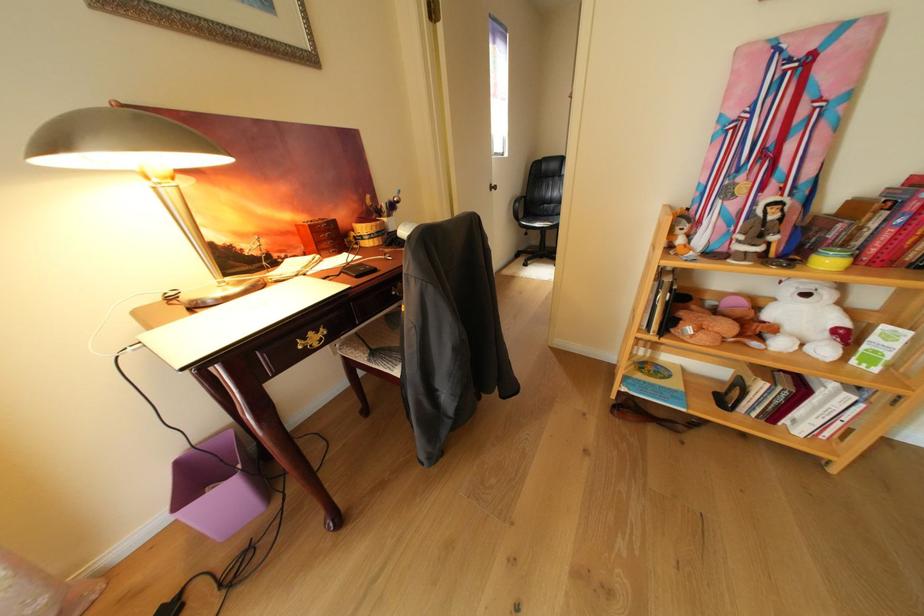
Where would you lift the purple trash can? Please return your answer as a coordinate pair (x, y).

(216, 487)